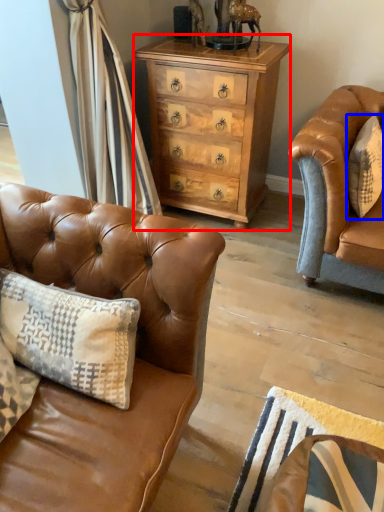
Question: Which of the following is the farthest to the observer, chest of drawers (highlighted by a red box) or pillow (highlighted by a blue box)?

Choices:
 (A) chest of drawers
 (B) pillow

Answer: (A)